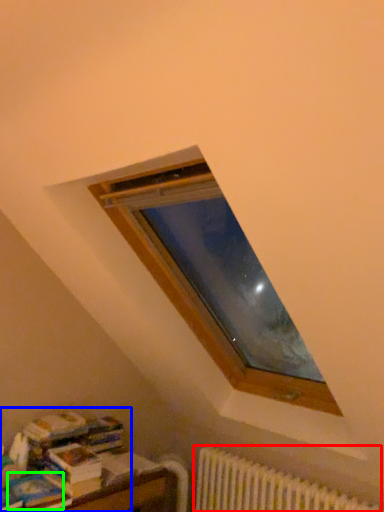
Question: Estimate the real-world distances between objects in this image. Which object is closer to radiator (highlighted by a red box), book (highlighted by a blue box) or paperback book (highlighted by a green box)?

Choices:
 (A) book
 (B) paperback book

Answer: (A)